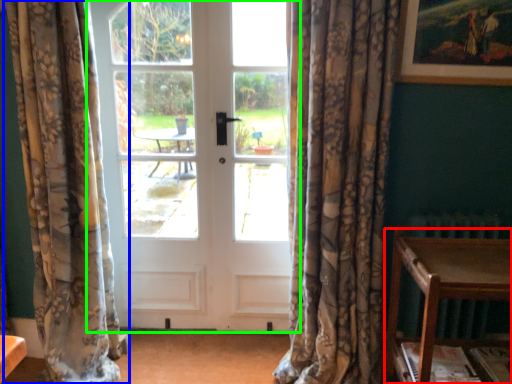
Question: Based on their relative distances, which object is nearer to table (highlighted by a red box)? Choose from curtain (highlighted by a blue box) and door (highlighted by a green box).

Choices:
 (A) curtain
 (B) door

Answer: (B)